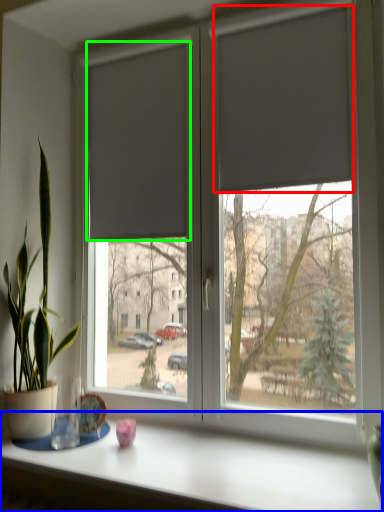
Question: Considering the real-world distances, which object is farthest from curtain (highlighted by a red box)? table (highlighted by a blue box) or curtain (highlighted by a green box)?

Choices:
 (A) table
 (B) curtain

Answer: (A)